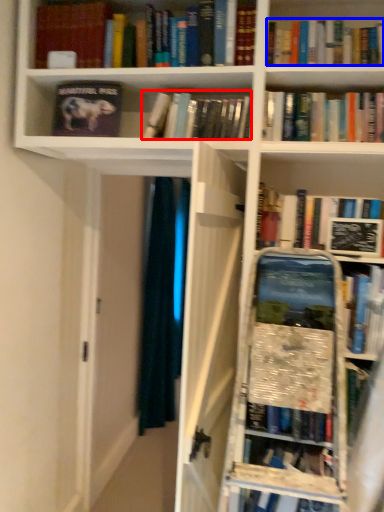
Question: Which object is closer to the camera taking this photo, book (highlighted by a red box) or book (highlighted by a blue box)?

Choices:
 (A) book
 (B) book

Answer: (B)